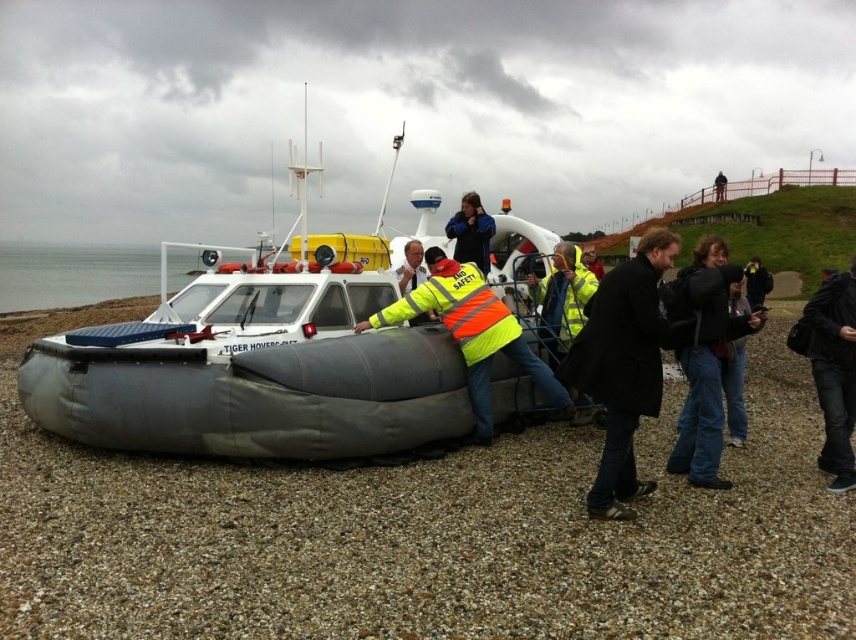
You are a technician inspecting the Tiger Hovercraft. You notice the gray rubber hovercraft at center and the black matte coat at center. Which object is positioned lower in the scene?

The gray rubber hovercraft at center is located below the black matte coat at center, so the gray rubber hovercraft at center is positioned lower in the scene.

You are a photographer standing at the edge of the beach. You want to take a photo of the gray rubber hovercraft at center and the black matte coat at center. Which object should you focus on first to ensure it appears sharp in the photo?

The gray rubber hovercraft at center is closer to you than the black matte coat at center, so you should focus on the gray rubber hovercraft at center first to ensure it appears sharp in the photo.